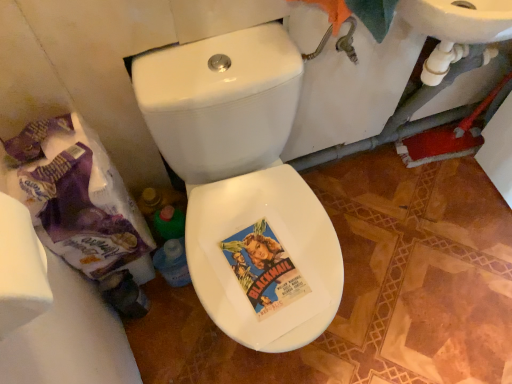
Where is `vacant region to the right of white glossy toilet at center`? vacant region to the right of white glossy toilet at center is located at coordinates (388, 318).